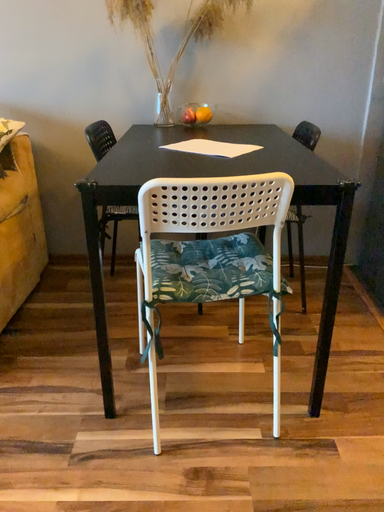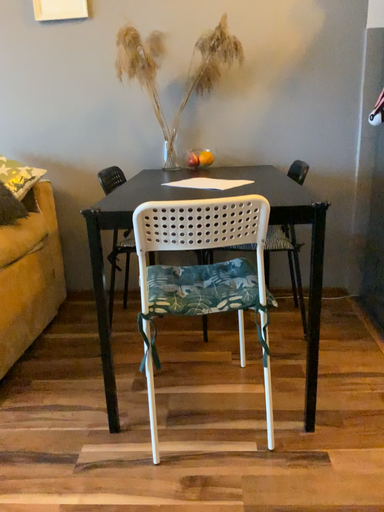
Question: Which way did the camera rotate in the video?

Choices:
 (A) rotated downward
 (B) rotated upward

Answer: (B)